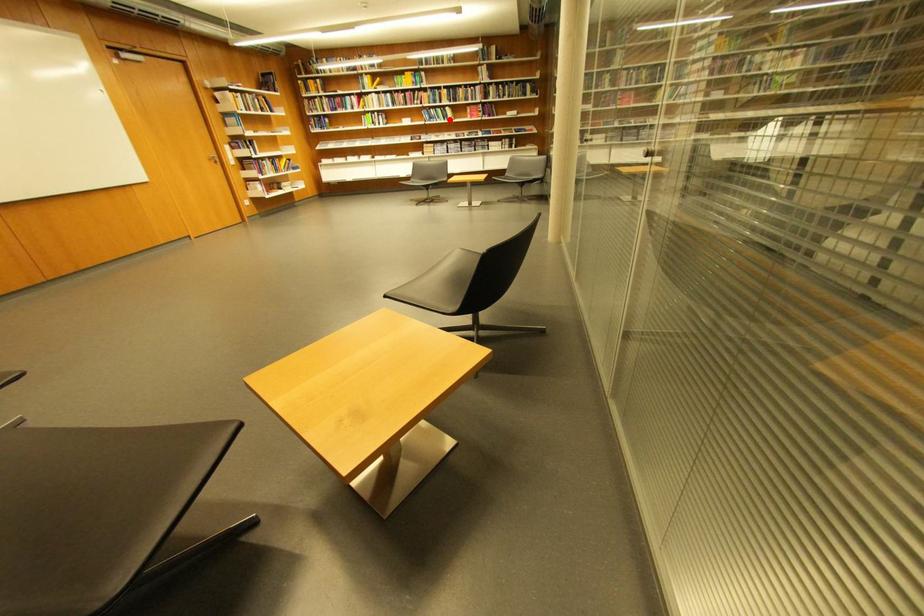
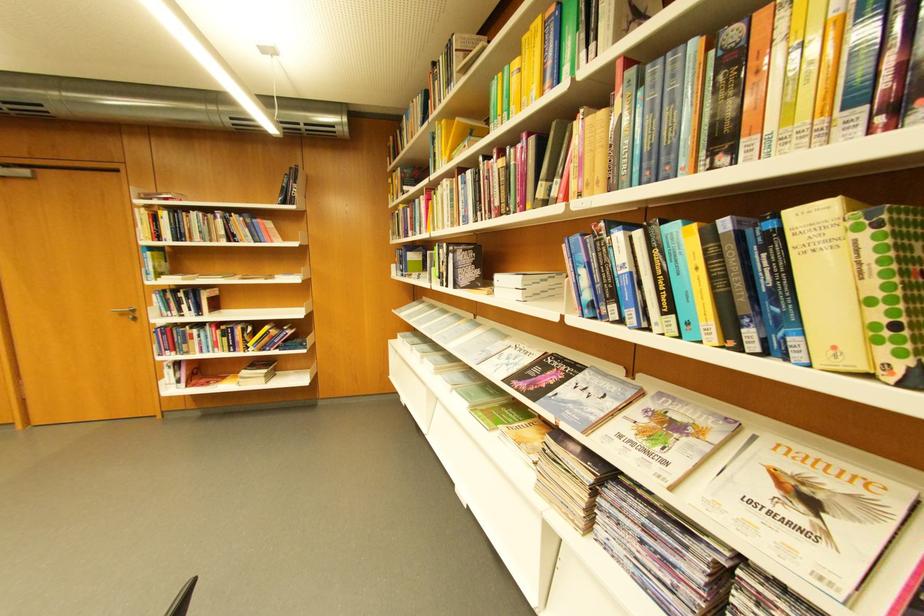
Question: I am providing you with two images of the same scene from different viewpoints. A red point is shown in image1. For the corresponding object point in image2, is it positioned nearer or farther from the camera?

Choices:
 (A) Nearer
 (B) Farther

Answer: (B)